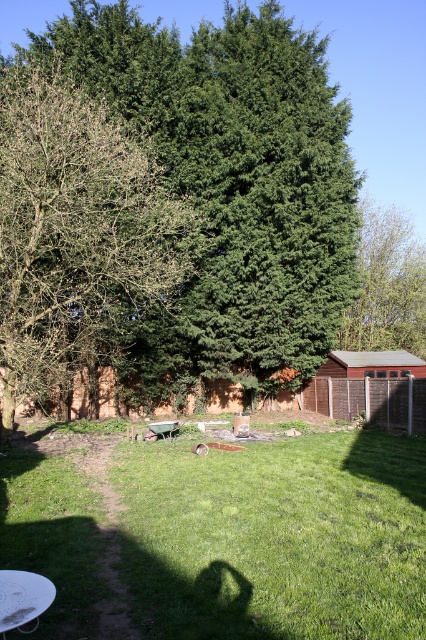
Does green leafy tree at center have a lesser height compared to green leafy tree at upper center?

No, green leafy tree at center is not shorter than green leafy tree at upper center.

What do you see at coordinates (230, 184) in the screenshot?
I see `green leafy tree at center` at bounding box center [230, 184].

Describe the element at coordinates (230, 184) in the screenshot. I see `green leafy tree at center` at that location.

You are a GUI agent. You are given a task and a screenshot of the screen. Output one action in this format:
    pyautogui.click(x=<x>, y=<y>)
    Task: Click on the green leafy tree at center
    This screenshot has width=426, height=640.
    Given the screenshot: What is the action you would take?
    point(230,184)

Can you confirm if green leafy tree at center is wider than bare branches at left?

Correct, the width of green leafy tree at center exceeds that of bare branches at left.

Between point (316, 138) and point (157, 301), which one is positioned behind?

The point (316, 138) is behind.

The image size is (426, 640). I want to click on green leafy tree at center, so click(230, 184).

Which of these two, bare branches at left or green leafy tree at upper center, stands shorter?

With less height is green leafy tree at upper center.

Is bare branches at left further to camera compared to green leafy tree at upper center?

No, bare branches at left is in front of green leafy tree at upper center.

I want to click on bare branches at left, so click(x=77, y=236).

Image resolution: width=426 pixels, height=640 pixels. Identify the location of bare branches at left. (77, 236).